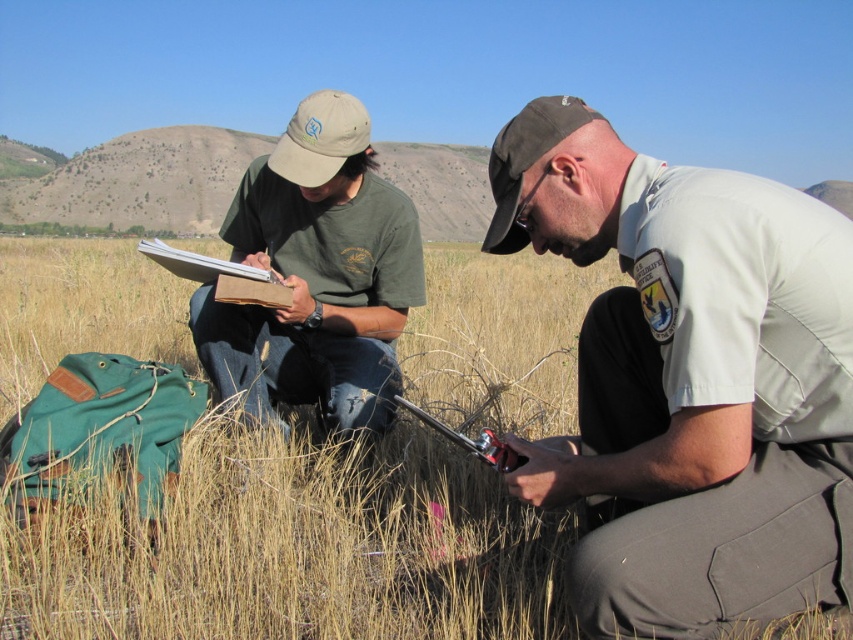
Between tan uniform at center and green matte t-shirt at left, which one has less height?

With less height is tan uniform at center.

Can you confirm if tan uniform at center is positioned above green matte t-shirt at left?

Incorrect, tan uniform at center is not positioned above green matte t-shirt at left.

Measure the distance between point (786, 515) and camera.

Point (786, 515) and camera are 1.23 meters apart.

The width and height of the screenshot is (853, 640). In order to click on tan uniform at center in this screenshot , I will do `click(689, 380)`.

Is dry grass at center to the left of green matte t-shirt at left from the viewer's perspective?

In fact, dry grass at center is to the right of green matte t-shirt at left.

Is dry grass at center taller than green matte t-shirt at left?

Indeed, dry grass at center has a greater height compared to green matte t-shirt at left.

What do you see at coordinates (296, 547) in the screenshot? I see `dry grass at center` at bounding box center [296, 547].

Identify the location of dry grass at center. The height and width of the screenshot is (640, 853). click(x=296, y=547).

Which is below, dry grass at center or tan uniform at center?

tan uniform at center is lower down.

Who is taller, dry grass at center or tan uniform at center?

Standing taller between the two is dry grass at center.

Is point (532, 323) in front of point (610, 353)?

No, it is not.

Where is `dry grass at center`? The image size is (853, 640). dry grass at center is located at coordinates (296, 547).